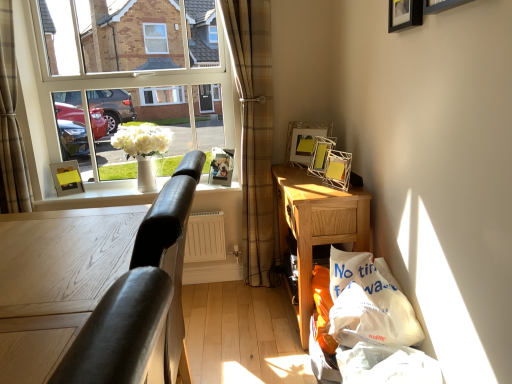
The height and width of the screenshot is (384, 512). What do you see at coordinates (143, 150) in the screenshot? I see `white ceramic vase at window` at bounding box center [143, 150].

Locate an element on the screen. The width and height of the screenshot is (512, 384). white plastic bag at lower right is located at coordinates (371, 326).

Image resolution: width=512 pixels, height=384 pixels. What do you see at coordinates (255, 132) in the screenshot?
I see `brown plaid curtain at left, which appears as the first curtain when viewed from the right` at bounding box center [255, 132].

This screenshot has height=384, width=512. I want to click on clear glass window at upper left, so click(x=127, y=83).

Where is `black leather table at left`? black leather table at left is located at coordinates (55, 282).

Can you tell me how much black leather table at left and white glossy window sill at center differ in facing direction?

There is a 90.6-degree angle between the facing directions of black leather table at left and white glossy window sill at center.

Considering the sizes of objects black leather table at left and white glossy window sill at center in the image provided, who is shorter, black leather table at left or white glossy window sill at center?

white glossy window sill at center.

From the image's perspective, is black leather table at left beneath white glossy window sill at center?

Yes.

Is black leather table at left in front of or behind white glossy window sill at center in the image?

black leather table at left is in front of white glossy window sill at center.

Is black leather table at left in front of or behind wooden desk at lower right in the image?

black leather table at left is positioned closer to the viewer than wooden desk at lower right.

Is black leather table at left positioned with its back to wooden desk at lower right?

No, black leather table at left's orientation is not away from wooden desk at lower right.

Between black leather table at left and wooden desk at lower right, which one has larger width?

black leather table at left.

From the image's perspective, which is below, metallic silver picture frame at upper center, the third picture frame from the right, or wooden picture frame at upper right, positioned as the 1th picture frame in front-to-back order?

metallic silver picture frame at upper center, the third picture frame from the right, appears lower in the image.

Are metallic silver picture frame at upper center, the third picture frame from the front, and wooden picture frame at upper right, placed as the sixth picture frame when sorted from back to front, located far from each other?

metallic silver picture frame at upper center, the third picture frame from the front, is positioned a significant distance from wooden picture frame at upper right, placed as the sixth picture frame when sorted from back to front.

Which is behind, metallic silver picture frame at upper center, the third picture frame from the right, or wooden picture frame at upper right, which appears as the sixth picture frame when viewed from the left?

metallic silver picture frame at upper center, the third picture frame from the right, is further away from the camera.

Considering the positions of point (316, 143) and point (453, 2), is point (316, 143) closer or farther from the camera than point (453, 2)?

Point (316, 143).

Considering the positions of objects metallic silver picture frame at upper center, the third picture frame from the right, and black leather table at left in the image provided, who is more to the right, metallic silver picture frame at upper center, the third picture frame from the right, or black leather table at left?

metallic silver picture frame at upper center, the third picture frame from the right, is more to the right.

Is metallic silver picture frame at upper center, the third picture frame from the right, aimed at black leather table at left?

Yes, metallic silver picture frame at upper center, the third picture frame from the right, is aimed at black leather table at left.

Can you confirm if metallic silver picture frame at upper center, the third picture frame from the front, is thinner than black leather table at left?

Indeed, metallic silver picture frame at upper center, the third picture frame from the front, has a lesser width compared to black leather table at left.

Identify the location of table located below the metallic silver picture frame at upper center, the third picture frame from the right (from the image's perspective). (55, 282).

Where is `window sill on the left of black matte picture frame at upper right, the second picture frame viewed from the right`? window sill on the left of black matte picture frame at upper right, the second picture frame viewed from the right is located at coordinates (96, 199).

Is point (95, 198) closer or farther from the camera than point (413, 5)?

Point (95, 198) is positioned farther from the camera compared to point (413, 5).

Which object is positioned more to the right, white glossy window sill at center or black matte picture frame at upper right, which is the fifth picture frame in left-to-right order?

black matte picture frame at upper right, which is the fifth picture frame in left-to-right order, is more to the right.

From the image's perspective, which object appears higher, white glossy window sill at center or black matte picture frame at upper right, which is counted as the 5th picture frame, starting from the back?

black matte picture frame at upper right, which is counted as the 5th picture frame, starting from the back, appears higher in the image.

Based on the photo, how much distance is there between clear glass window at upper left and metallic silver picture frame at upper right, the 3th picture frame positioned from the back?

clear glass window at upper left is 37.33 inches away from metallic silver picture frame at upper right, the 3th picture frame positioned from the back.

Which is farther from the camera, (122, 164) or (287, 157)?

The point (122, 164) is more distant.

From a real-world perspective, between clear glass window at upper left and metallic silver picture frame at upper right, the third picture frame viewed from the left, who is vertically higher?

clear glass window at upper left, from a real-world perspective.

In the image, is clear glass window at upper left positioned in front of or behind metallic silver picture frame at upper right, marked as the fourth picture frame in a front-to-back arrangement?

Visually, clear glass window at upper left is located behind metallic silver picture frame at upper right, marked as the fourth picture frame in a front-to-back arrangement.

What's the angular difference between black leather chair at left and white glossy window sill at center's facing directions?

The angular difference between black leather chair at left and white glossy window sill at center is 91.4 degrees.

Is black leather chair at left inside the boundaries of white glossy window sill at center, or outside?

black leather chair at left is outside white glossy window sill at center.

Between point (172, 303) and point (87, 203), which one is positioned behind?

The point (87, 203) is more distant.

Where is `table below the white glossy window sill at center (from a real-world perspective)`? The height and width of the screenshot is (384, 512). table below the white glossy window sill at center (from a real-world perspective) is located at coordinates (55, 282).

I want to click on desk above the black leather table at left (from the image's perspective), so click(317, 225).

Considering their positions, is wooden picture frame at upper right, placed as the sixth picture frame when sorted from back to front, positioned closer to black leather chair at left than brown plaid curtain at left, which appears as the first curtain when viewed from the right?

wooden picture frame at upper right, placed as the sixth picture frame when sorted from back to front.

From the image, which object appears to be nearer to brown plaid curtain at left, marked as the 2th curtain in a left-to-right arrangement, clear glass window at upper left or plaid fabric curtain at left, the 2th curtain viewed from the right?

The object closer to brown plaid curtain at left, marked as the 2th curtain in a left-to-right arrangement, is clear glass window at upper left.

Looking at the image, which one is located further to matte yellow picture frame at left, arranged as the fifth picture frame when viewed from the front, metallic silver picture frame at upper right, which appears as the fourth picture frame when viewed from the right, or metallic silver picture frame at upper center, the third picture frame from the right?

metallic silver picture frame at upper center, the third picture frame from the right, lies further to matte yellow picture frame at left, arranged as the fifth picture frame when viewed from the front, than the other object.

Which object lies further to the anchor point plaid fabric curtain at left, the 1th curtain in the left-to-right sequence, wooden picture frame at upper right, the first picture frame viewed from the right, or clear glass window at upper left?

wooden picture frame at upper right, the first picture frame viewed from the right, is positioned further to the anchor plaid fabric curtain at left, the 1th curtain in the left-to-right sequence.

Based on their spatial positions, is black matte picture frame at upper right, the second picture frame viewed from the right, or wooden picture frame at upper right, positioned as the 1th picture frame in front-to-back order, closer to brown plaid curtain at left, marked as the 2th curtain in a left-to-right arrangement?

black matte picture frame at upper right, the second picture frame viewed from the right, is closer to brown plaid curtain at left, marked as the 2th curtain in a left-to-right arrangement.

From the image, which object appears to be nearer to metallic silver picture frame at upper center, arranged as the fourth picture frame when viewed from the back, black leather chair at left or black leather table at left?

Based on the image, black leather chair at left appears to be nearer to metallic silver picture frame at upper center, arranged as the fourth picture frame when viewed from the back.

Looking at the image, which one is located further to clear glass window at upper left, black matte picture frame at upper right, which is the fifth picture frame in left-to-right order, or matte yellow picture frame at left, which appears as the 6th picture frame when viewed from the right?

Based on the image, black matte picture frame at upper right, which is the fifth picture frame in left-to-right order, appears to be further to clear glass window at upper left.

When comparing their distances from white ceramic vase at window, does black leather table at left or plaid fabric curtain at left, the 2th curtain viewed from the right, seem further?

Among the two, black leather table at left is located further to white ceramic vase at window.

This screenshot has width=512, height=384. In order to click on window located between plaid fabric curtain at left, the 1th curtain in the left-to-right sequence, and wooden picture frame at upper right, the first picture frame viewed from the right, in the left-right direction in this screenshot , I will do `click(127, 83)`.

Locate an element on the screen. The width and height of the screenshot is (512, 384). desk between black leather chair at left and brown plaid curtain at left, marked as the 2th curtain in a left-to-right arrangement, along the z-axis is located at coordinates (317, 225).

In order to click on shopping bag between black leather table at left and metallic silver picture frame at upper right, the third picture frame viewed from the left, along the z-axis in this screenshot , I will do `click(371, 326)`.

Identify the location of shopping bag between black leather table at left and metallic silver picture frame at upper center, the third picture frame from the front, in the front-back direction. This screenshot has width=512, height=384. (371, 326).